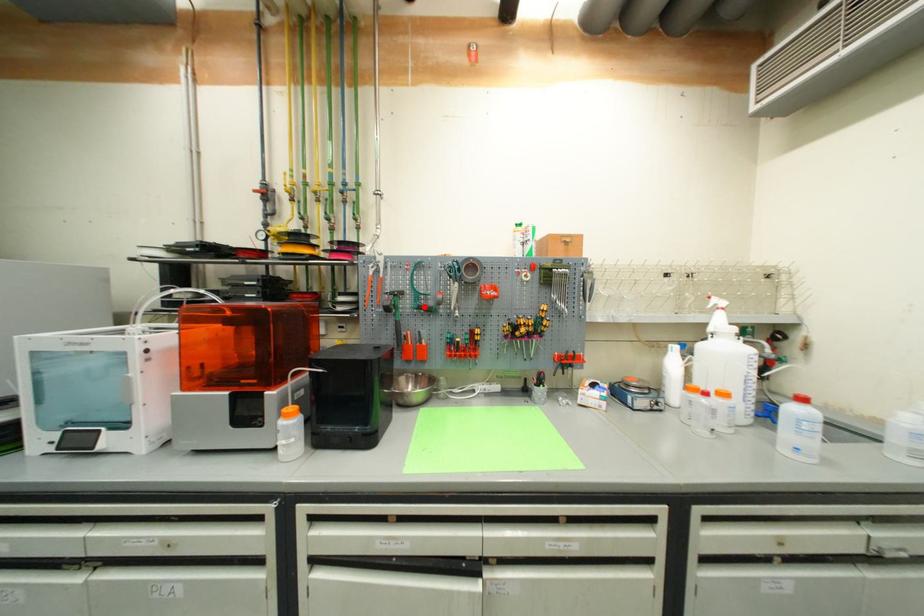
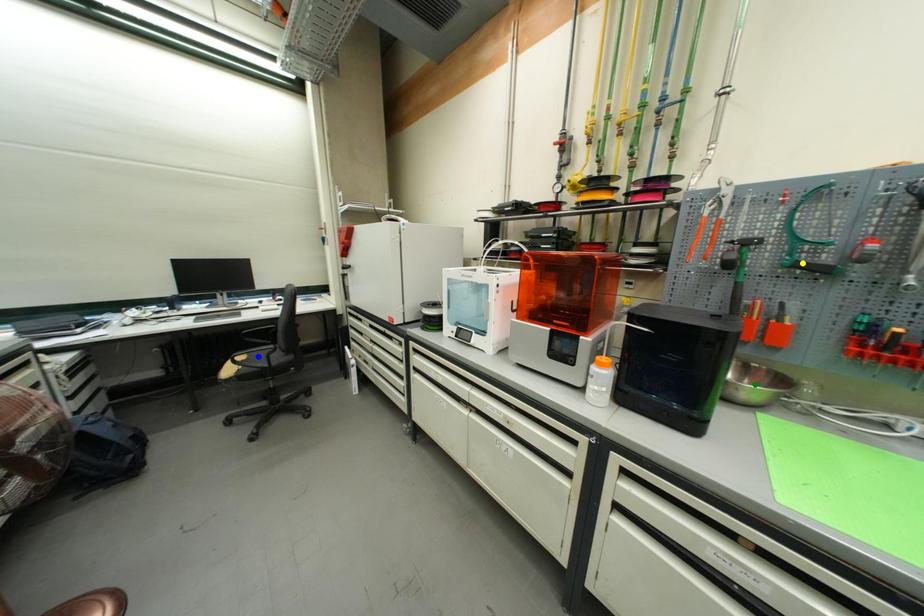
Question: I am providing you with two images of the same scene from different viewpoints. A red point is marked on the first image. You are given multiple points on the second image. Which spot in image 2 lines up with the point in image 1?

Choices:
 (A) green point
 (B) blue point
 (C) yellow point

Answer: (C)